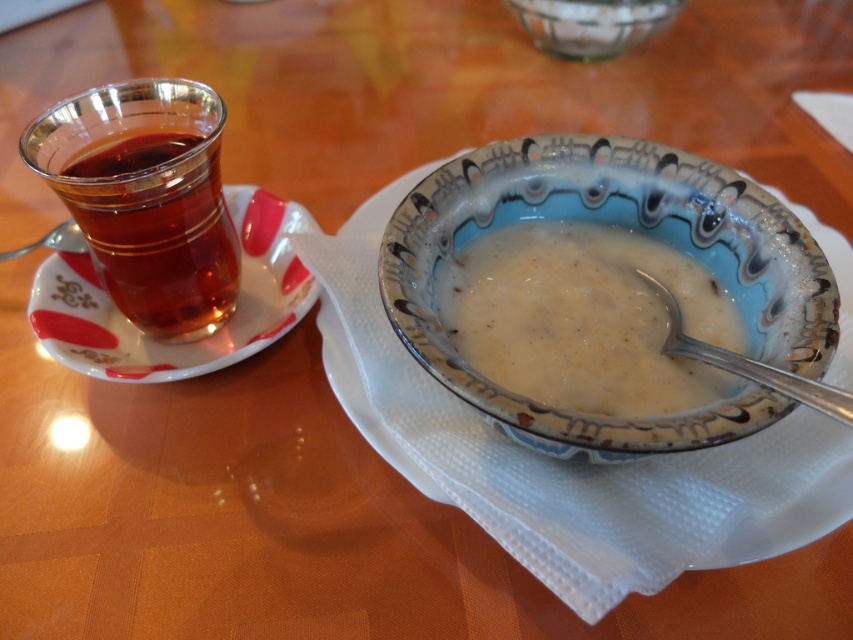
Is porcelain bowl at center to the left of white ceramic saucer at left from the viewer's perspective?

Incorrect, porcelain bowl at center is not on the left side of white ceramic saucer at left.

Who is higher up, porcelain bowl at center or white ceramic saucer at left?

Positioned higher is white ceramic saucer at left.

Image resolution: width=853 pixels, height=640 pixels. I want to click on porcelain bowl at center, so click(x=625, y=227).

This screenshot has height=640, width=853. I want to click on porcelain bowl at center, so click(625, 227).

Is white ceramic saucer at left further to camera compared to silver metallic spoon at bowl center?

Yes.

Is point (80, 308) closer to camera compared to point (842, 417)?

No, (80, 308) is behind (842, 417).

You are a GUI agent. You are given a task and a screenshot of the screen. Output one action in this format:
    pyautogui.click(x=<x>, y=<y>)
    Task: Click on the white ceramic saucer at left
    This screenshot has height=640, width=853.
    Given the screenshot: What is the action you would take?
    pyautogui.click(x=186, y=342)

Between point (91, 154) and point (782, 388), which one is positioned in front?

Point (782, 388) is more forward.

Is point (225, 236) behind point (781, 384)?

Yes, point (225, 236) is behind point (781, 384).

This screenshot has height=640, width=853. What are the coordinates of `transparent glass tea at left` in the screenshot? It's located at (160, 234).